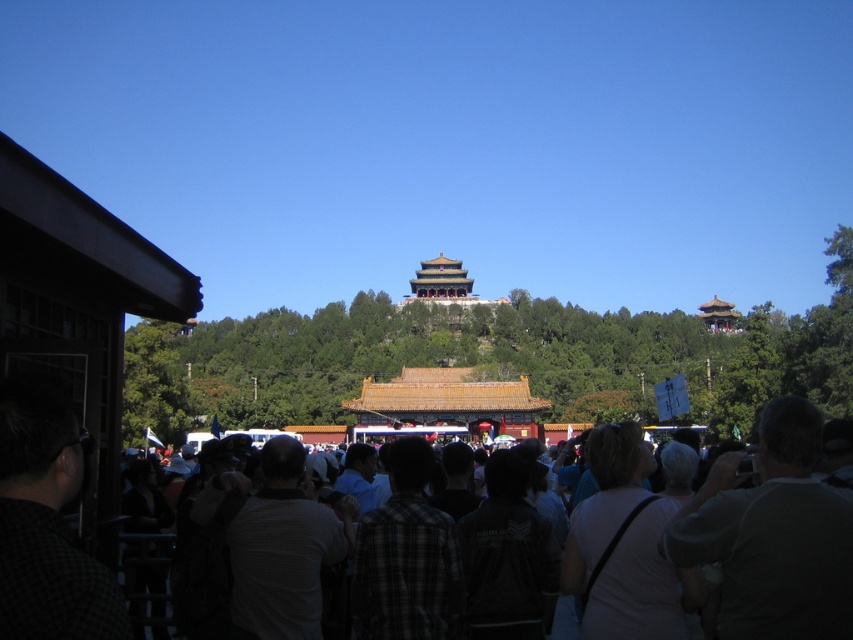
Question: Considering the relative positions of black checkered shirt at left and white cotton shirt at center in the image provided, where is black checkered shirt at left located with respect to white cotton shirt at center?

Choices:
 (A) above
 (B) below

Answer: (A)

Question: Which of these objects is positioned farthest from the white cotton shirt at center?

Choices:
 (A) plaid shirt at center
 (B) dark gray shirt at center
 (C) dark gray shirt at lower right

Answer: (A)

Question: Is dark gray shirt at center thinner than white checkered shirt at center?

Choices:
 (A) yes
 (B) no

Answer: (B)

Question: Estimate the real-world distances between objects in this image. Which object is farther from the black checkered shirt at left?

Choices:
 (A) white cotton shirt at center
 (B) white checkered shirt at center

Answer: (A)

Question: Based on their relative distances, which object is farther from the dark gray shirt at center?

Choices:
 (A) white cotton shirt at center
 (B) dark plaid shirt at center
 (C) white checkered shirt at center

Answer: (B)

Question: Does dark gray shirt at lower right appear on the right side of plaid shirt at center?

Choices:
 (A) no
 (B) yes

Answer: (B)